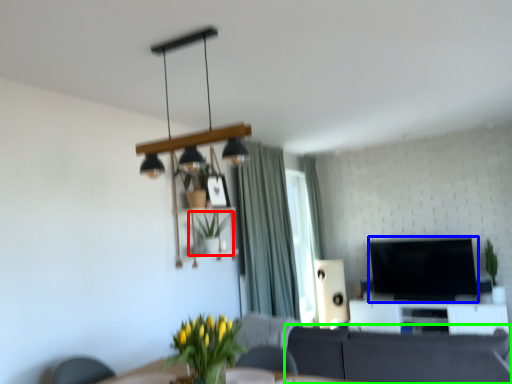
Question: Considering the real-world distances, which object is closest to houseplant (highlighted by a red box)? television (highlighted by a blue box) or studio couch (highlighted by a green box).

Choices:
 (A) television
 (B) studio couch

Answer: (B)